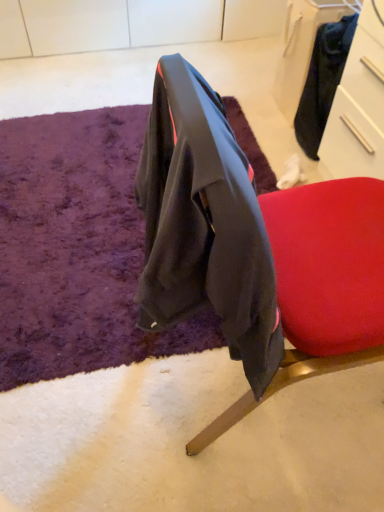
Question: Does black fabric drawer at upper right come behind purple shaggy rug at center?

Choices:
 (A) yes
 (B) no

Answer: (A)

Question: Does black fabric drawer at upper right contain purple shaggy rug at center?

Choices:
 (A) yes
 (B) no

Answer: (B)

Question: Does black fabric drawer at upper right have a lesser height compared to purple shaggy rug at center?

Choices:
 (A) yes
 (B) no

Answer: (B)

Question: Does black fabric drawer at upper right have a greater width compared to purple shaggy rug at center?

Choices:
 (A) yes
 (B) no

Answer: (B)

Question: From a real-world perspective, is black fabric drawer at upper right located higher than purple shaggy rug at center?

Choices:
 (A) no
 (B) yes

Answer: (B)

Question: Is there a large distance between black fabric drawer at upper right and purple shaggy rug at center?

Choices:
 (A) yes
 (B) no

Answer: (B)

Question: Is velvet-like black jacket at center positioned behind black fabric drawer at upper right?

Choices:
 (A) no
 (B) yes

Answer: (A)

Question: Can we say velvet-like black jacket at center lies outside black fabric drawer at upper right?

Choices:
 (A) yes
 (B) no

Answer: (A)

Question: From a real-world perspective, is velvet-like black jacket at center positioned under black fabric drawer at upper right based on gravity?

Choices:
 (A) no
 (B) yes

Answer: (A)

Question: Could black fabric drawer at upper right be considered to be inside velvet-like black jacket at center?

Choices:
 (A) yes
 (B) no

Answer: (B)

Question: Considering the relative positions of velvet-like black jacket at center and black fabric drawer at upper right in the image provided, is velvet-like black jacket at center to the right of black fabric drawer at upper right from the viewer's perspective?

Choices:
 (A) yes
 (B) no

Answer: (B)

Question: Is velvet-like black jacket at center oriented towards black fabric drawer at upper right?

Choices:
 (A) yes
 (B) no

Answer: (B)

Question: Is black fabric drawer at upper right facing away from velvet-like black jacket at center?

Choices:
 (A) yes
 (B) no

Answer: (B)